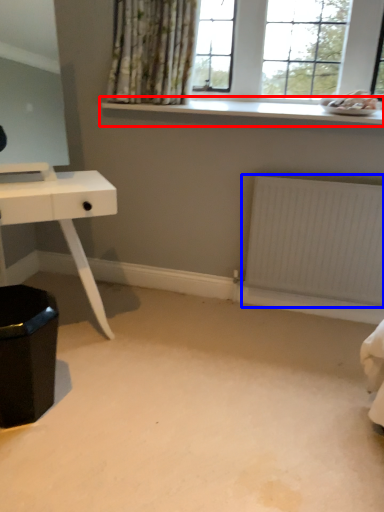
Question: Among these objects, which one is nearest to the camera, window sill (highlighted by a red box) or radiator (highlighted by a blue box)?

Choices:
 (A) window sill
 (B) radiator

Answer: (A)